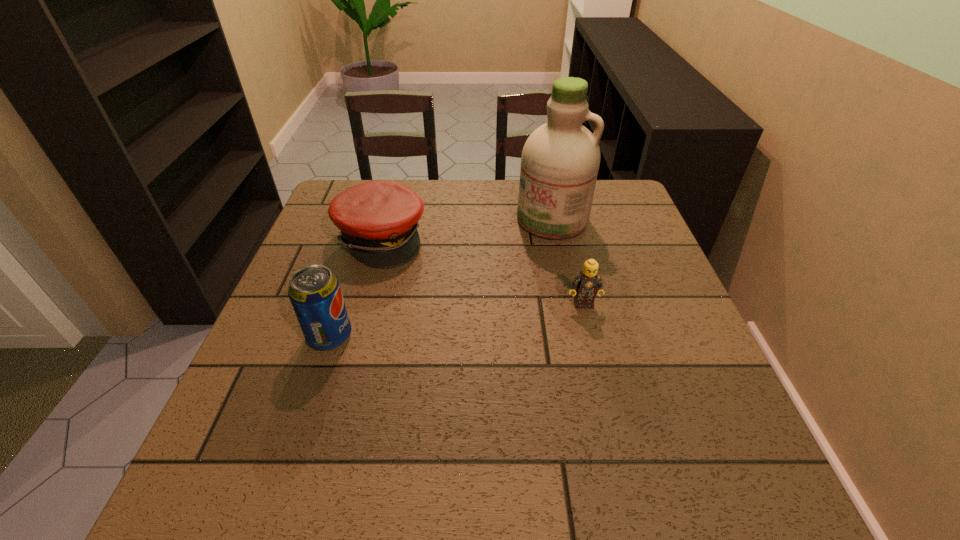
At what (x,y) coordinates should I click in order to perform the action: click on soda. Please return your answer as a coordinate pair (x, y). Looking at the image, I should click on (315, 294).

Locate an element on the screen. the nearest object is located at coordinates (315, 294).

I want to click on Lego, so click(x=588, y=283).

Where is `cleansing agent`? The image size is (960, 540). cleansing agent is located at coordinates (560, 160).

Locate an element on the screen. This screenshot has width=960, height=540. cap is located at coordinates (378, 219).

What are the coordinates of `free space located on the back of the third shortest object` in the screenshot? It's located at (368, 222).

Identify the location of vacant space located in front of the second nearest object. Image resolution: width=960 pixels, height=540 pixels. (589, 333).

This screenshot has height=540, width=960. In order to click on free spot located 0.120m on the front label of the cleansing agent in this screenshot , I will do 522,265.

Find the location of `vacant space situated 0.390m on the front label of the cleansing agent`. vacant space situated 0.390m on the front label of the cleansing agent is located at coordinates (471, 340).

Where is `free space located on the front label of the cleansing agent`? This screenshot has width=960, height=540. free space located on the front label of the cleansing agent is located at coordinates (528, 256).